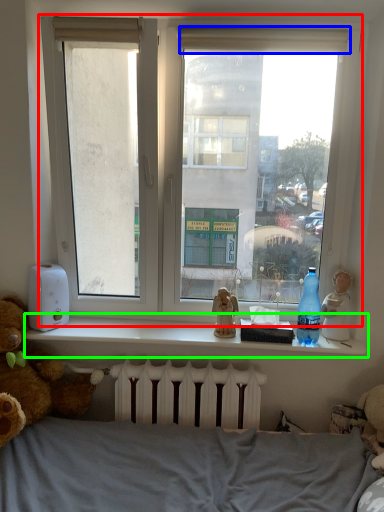
Question: Considering the real-world distances, which object is closest to window (highlighted by a red box)? curtain (highlighted by a blue box) or window sill (highlighted by a green box).

Choices:
 (A) curtain
 (B) window sill

Answer: (A)